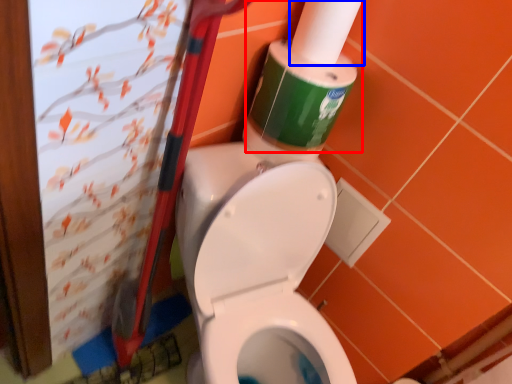
Question: Which of the following is the closest to the observer, cleaning product (highlighted by a red box) or toilet paper (highlighted by a blue box)?

Choices:
 (A) cleaning product
 (B) toilet paper

Answer: (B)